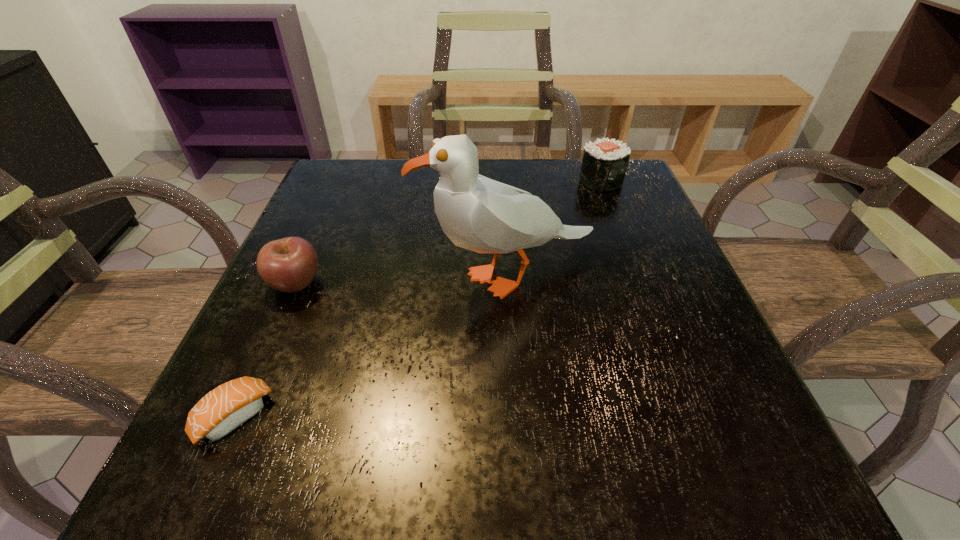
At what (x,y) coordinates should I click in order to perform the action: click on unoccupied position between the shorter sushi and the taller sushi. Please return your answer as a coordinate pair (x, y). Looking at the image, I should click on (418, 299).

At what (x,y) coordinates should I click in order to perform the action: click on free space between the shorter sushi and the apple. Please return your answer as a coordinate pair (x, y). This screenshot has width=960, height=540. Looking at the image, I should click on (266, 350).

Find the location of `free point between the farther sushi and the left sushi`. free point between the farther sushi and the left sushi is located at coordinates (418, 299).

Locate an element on the screen. This screenshot has width=960, height=540. empty space between the tallest object and the apple is located at coordinates (403, 280).

You are a GUI agent. You are given a task and a screenshot of the screen. Output one action in this format:
    pyautogui.click(x=<x>, y=<y>)
    Task: Click on the vacant region between the shortest object and the taller sushi
    This screenshot has width=960, height=540.
    Given the screenshot: What is the action you would take?
    pyautogui.click(x=418, y=299)

Identify the location of the third closest object relative to the tallest object. [x=228, y=406].

The height and width of the screenshot is (540, 960). In order to click on object that is the second closest to the third object from left to right in this screenshot , I will do `click(604, 164)`.

Identify the location of free spot that satisfies the following two spatial constraints: 1. at the beak of the tallest object; 2. on the front side of the shortest object. (519, 417).

The height and width of the screenshot is (540, 960). What are the coordinates of `vacant space that satisfies the following two spatial constraints: 1. at the beak of the tallest object; 2. on the front side of the shortest object` in the screenshot? It's located at (519, 417).